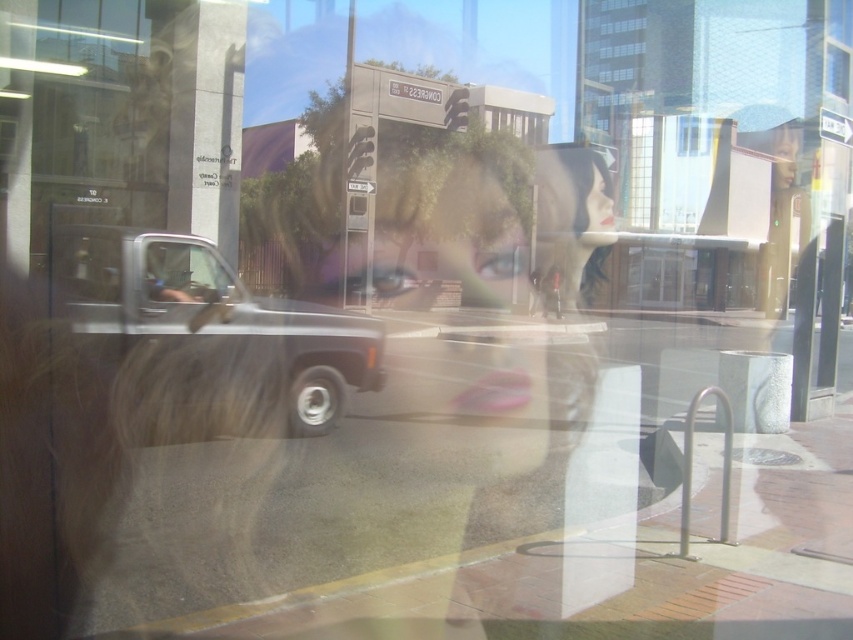
Question: Which of the following is the farthest from the observer?

Choices:
 (A) (247, 410)
 (B) (183, 256)

Answer: (A)

Question: Does silver metallic truck at center lie in front of clear glass window at center?

Choices:
 (A) yes
 (B) no

Answer: (B)

Question: Can you confirm if silver metallic truck at center is positioned below clear glass window at center?

Choices:
 (A) no
 (B) yes

Answer: (B)

Question: Which point is closer to the camera taking this photo?

Choices:
 (A) (184, 272)
 (B) (250, 307)

Answer: (A)

Question: Can you confirm if silver metallic truck at center is positioned to the left of clear glass window at center?

Choices:
 (A) yes
 (B) no

Answer: (A)